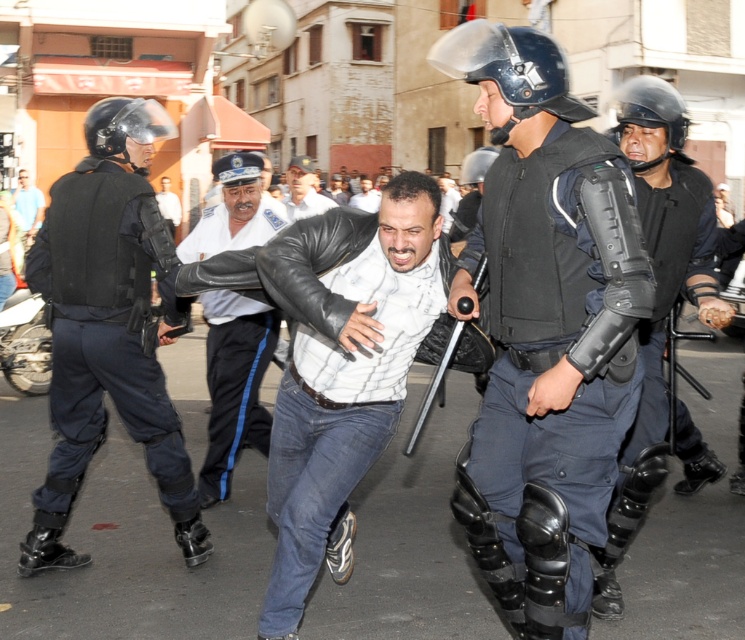
Question: Can you confirm if matte black helmet at center is positioned below black matte helmet at center?

Choices:
 (A) yes
 (B) no

Answer: (A)

Question: Which point is farther from the camera taking this photo?

Choices:
 (A) (378, 198)
 (B) (86, 333)
 (C) (320, 198)

Answer: (A)

Question: Can you confirm if matte black vest at left is smaller than black matte knee pads at lower right?

Choices:
 (A) yes
 (B) no

Answer: (A)

Question: Which point appears farthest from the camera in this image?

Choices:
 (A) (259, 321)
 (B) (174, 483)

Answer: (A)

Question: Where is black matte helmet at center located in relation to matte black helmet at upper left in the image?

Choices:
 (A) above
 (B) below

Answer: (A)

Question: Which is nearer to the black matte helmet at upper right?

Choices:
 (A) brushed metal motorcycle at left
 (B) black matte knee pads at lower right

Answer: (B)